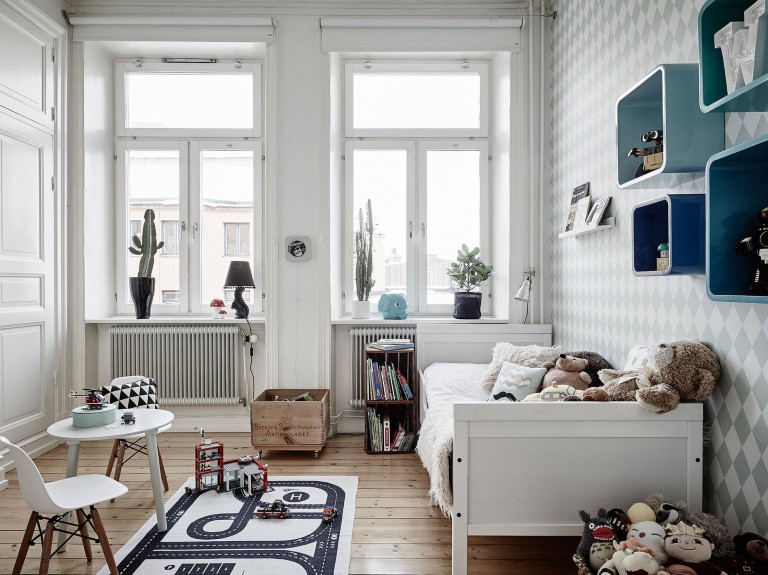
Image resolution: width=768 pixels, height=575 pixels. In order to click on bed in this screenshot , I will do `click(439, 402)`.